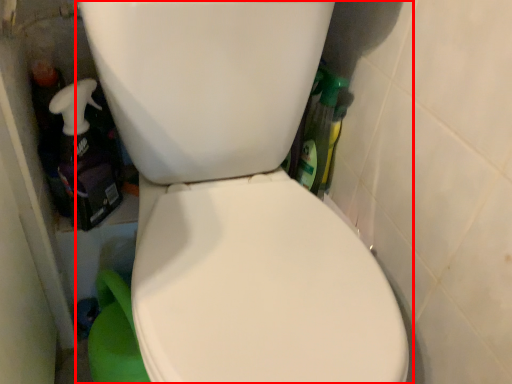
Question: From the image's perspective, what is the correct spatial positioning of toilet (annotated by the red box) in reference to cleaning product?

Choices:
 (A) below
 (B) above

Answer: (A)